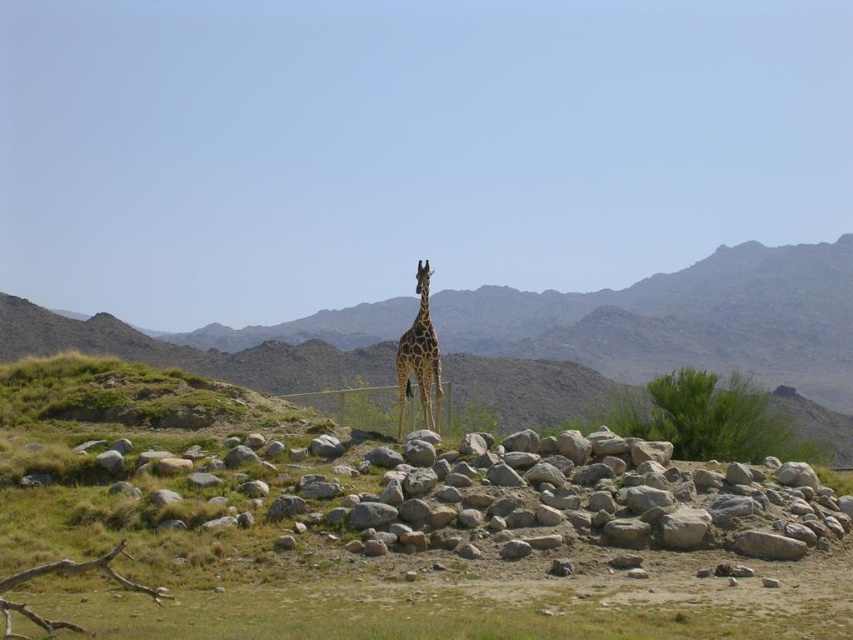
I want to click on brown rocky mountain at center, so click(683, 321).

Find the location of a particular element. brown rocky mountain at center is located at coordinates (683, 321).